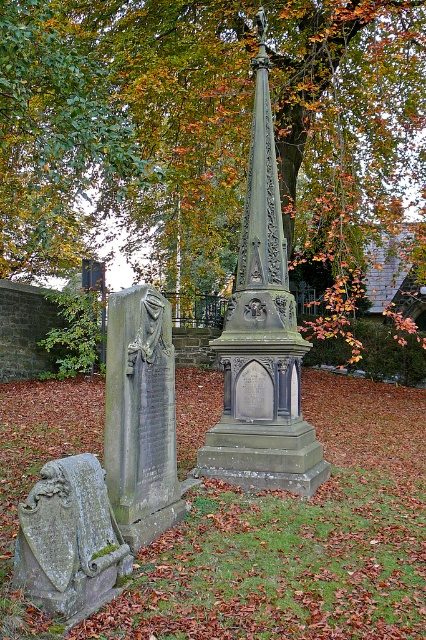
Question: Can you confirm if gray stone gravestone at left is positioned to the right of green mossy stone plaque at lower left?

Choices:
 (A) no
 (B) yes

Answer: (B)

Question: Based on their relative distances, which object is nearer to the gray stone gravestone at left?

Choices:
 (A) green mossy stone plaque at lower left
 (B) dark gray stone monument at center

Answer: (A)

Question: Where is gray stone gravestone at left located in relation to green mossy stone plaque at lower left in the image?

Choices:
 (A) left
 (B) right

Answer: (B)

Question: Does gray stone gravestone at left lie in front of green mossy stone plaque at lower left?

Choices:
 (A) yes
 (B) no

Answer: (B)

Question: Which point is farther to the camera?

Choices:
 (A) (112, 506)
 (B) (52, 586)
 (C) (227, 420)

Answer: (C)

Question: Which object is positioned farthest from the dark gray stone monument at center?

Choices:
 (A) green mossy stone plaque at lower left
 (B) gray stone gravestone at left

Answer: (A)